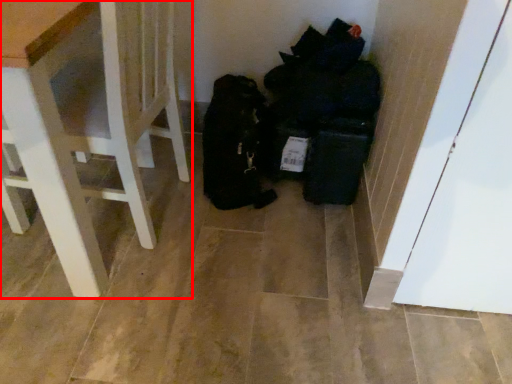
Question: Where is furniture (annotated by the red box) located in relation to garbage in the image?

Choices:
 (A) left
 (B) right

Answer: (A)